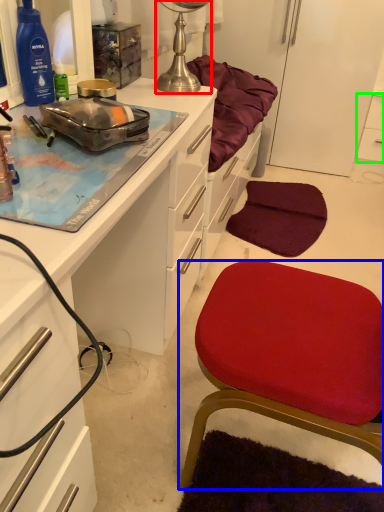
Question: Which is farther away from lamp (highlighted by a red box)? chair (highlighted by a blue box) or cabinetry (highlighted by a green box)?

Choices:
 (A) chair
 (B) cabinetry

Answer: (A)